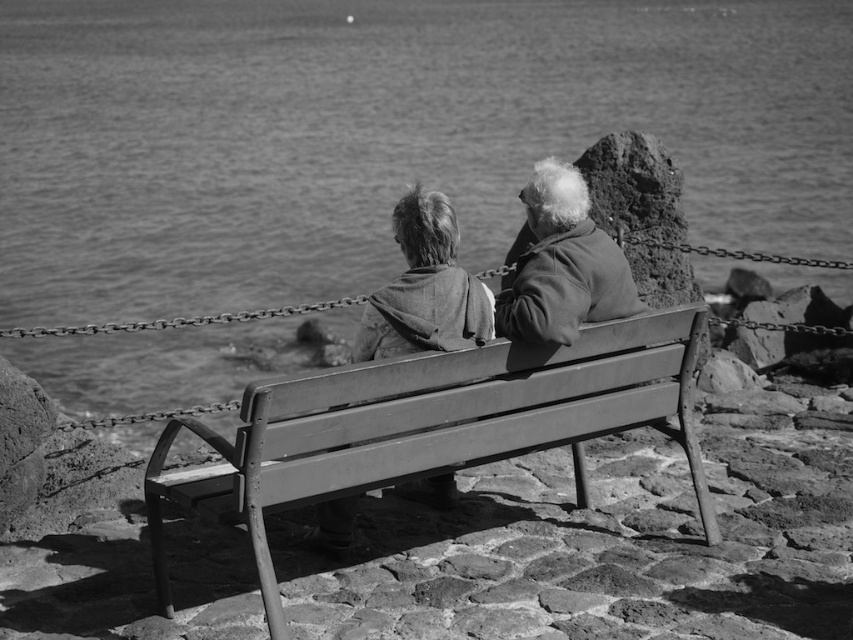
You are a photographer trying to capture a candid shot of the metal bench at center and the coarse fabric jacket at center. Since you want to focus on the bench, which object should you adjust your camera focus to prioritize, and why?

You should prioritize focusing on the metal bench at center because it is below the coarse fabric jacket at center, making it closer to the camera. This allows for a clearer focus on the bench while the jacket may appear slightly out of focus due to its position further away.

You are a photographer trying to capture a candid shot of the metal bench at center and the coarse woolen sweater at center. From the photographer perspective, which object is located more to the left?

The metal bench at center is positioned on the left side of coarse woolen sweater at center, so the metal bench at center is more to the left.

You are standing behind the bench and want to place a small gift on the bench between the two individuals. The gift needs to be placed closer to the smooth water at bench center than to the coarse fabric jacket at center. Where should you place the gift on the bench?

The smooth water at bench center is to the left of the coarse fabric jacket at center. Therefore, to place the gift closer to the smooth water at bench center, you should position it to the left side of the coarse fabric jacket at center.